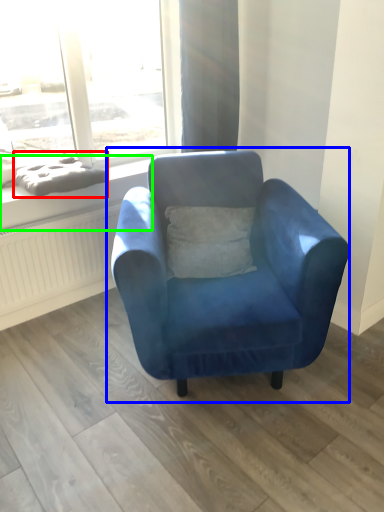
Question: Which is farther away from material (highlighted by a red box)? chair (highlighted by a blue box) or window sill (highlighted by a green box)?

Choices:
 (A) chair
 (B) window sill

Answer: (A)